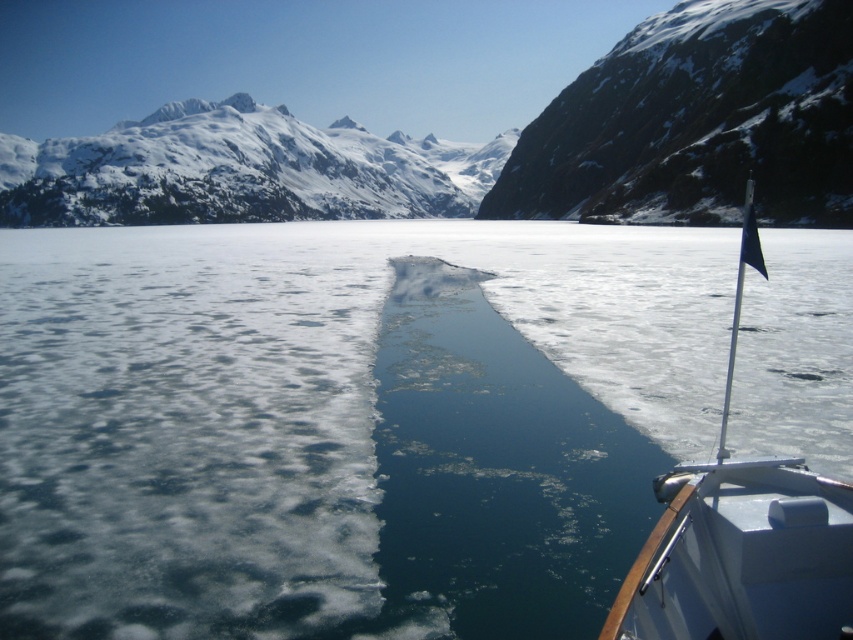
Question: Which of the following is the closest to the observer?

Choices:
 (A) (225, 104)
 (B) (573, 259)
 (C) (764, 531)

Answer: (C)

Question: Can you confirm if snowy rocky mountain at upper center is positioned below dark gray rocky cliff at upper right?

Choices:
 (A) no
 (B) yes

Answer: (A)

Question: Is clear ice at center smaller than snowy granite mountain at upper left?

Choices:
 (A) yes
 (B) no

Answer: (A)

Question: Among these points, which one is farthest from the camera?

Choices:
 (A) (805, 589)
 (B) (651, 90)
 (C) (155, 132)
 (D) (496, 205)

Answer: (C)

Question: Is snowy rocky mountain at upper center above snowy granite mountain at upper left?

Choices:
 (A) no
 (B) yes

Answer: (B)

Question: Among these objects, which one is nearest to the camera?

Choices:
 (A) snowy granite mountain at upper left
 (B) white glossy boat at right

Answer: (B)